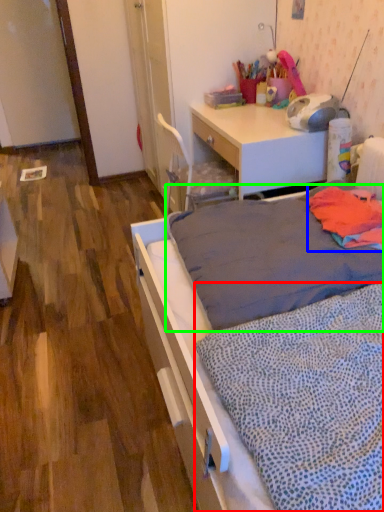
Question: Estimate the real-world distances between objects in this image. Which object is closer to blanket (highlighted by a red box), blanket (highlighted by a blue box) or mattress (highlighted by a green box)?

Choices:
 (A) blanket
 (B) mattress

Answer: (B)